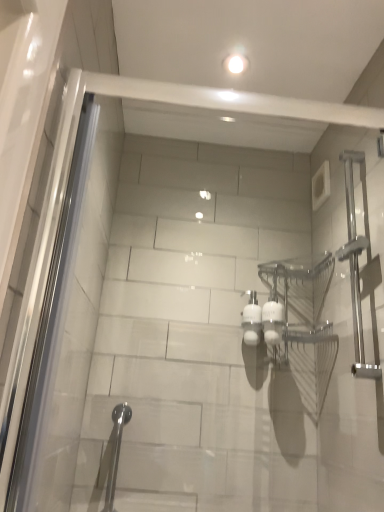
Question: Is point (379, 259) closer or farther from the camera than point (114, 440)?

Choices:
 (A) closer
 (B) farther

Answer: (A)

Question: Would you say satin nickel towel bar at right, the 2th shower ordered from the bottom, is to the left or to the right of satin nickel shower at lower left, placed as the 1th shower when sorted from left to right, in the picture?

Choices:
 (A) left
 (B) right

Answer: (B)

Question: From their relative heights in the image, would you say satin nickel towel bar at right, which is the 1th shower from right to left, is taller or shorter than satin nickel shower at lower left, the 1th shower positioned from the bottom?

Choices:
 (A) tall
 (B) short

Answer: (A)

Question: Considering the positions of satin nickel shower at lower left, which is counted as the second shower, starting from the top, and satin nickel towel bar at right, the 2th shower ordered from the bottom, in the image, is satin nickel shower at lower left, which is counted as the second shower, starting from the top, taller or shorter than satin nickel towel bar at right, the 2th shower ordered from the bottom,?

Choices:
 (A) short
 (B) tall

Answer: (A)

Question: Considering their positions, is satin nickel shower at lower left, the 1th shower positioned from the bottom, located in front of or behind satin nickel towel bar at right, the 2th shower ordered from the bottom?

Choices:
 (A) front
 (B) behind

Answer: (B)

Question: Looking at their shapes, would you say satin nickel shower at lower left, the 1th shower positioned from the bottom, is wider or thinner than satin nickel towel bar at right, the 1th shower when ordered from top to bottom?

Choices:
 (A) wide
 (B) thin

Answer: (B)

Question: Considering the positions of point (127, 415) and point (342, 251), is point (127, 415) closer or farther from the camera than point (342, 251)?

Choices:
 (A) farther
 (B) closer

Answer: (B)